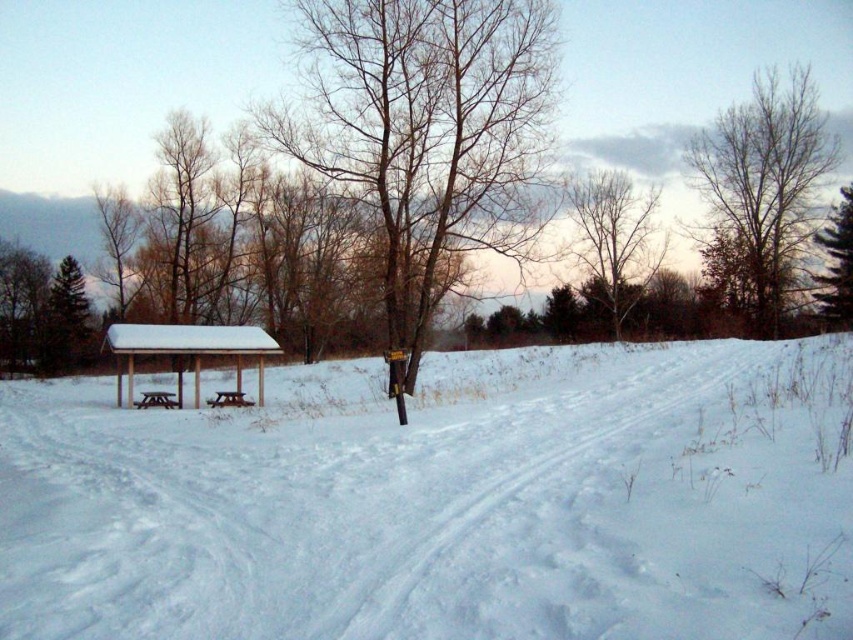
Is bare branches at center shorter than green matte tree at left?

No, bare branches at center is not shorter than green matte tree at left.

Does point (457, 179) come closer to viewer compared to point (62, 371)?

Yes, it is.

You are a GUI agent. You are given a task and a screenshot of the screen. Output one action in this format:
    pyautogui.click(x=<x>, y=<y>)
    Task: Click on the bare branches at center
    This screenshot has width=853, height=640.
    Given the screenshot: What is the action you would take?
    pyautogui.click(x=428, y=132)

Who is taller, white powdery snow at center or bare branches at upper center?

bare branches at upper center is taller.

Between white powdery snow at center and bare branches at upper center, which one has less height?

Standing shorter between the two is white powdery snow at center.

Who is more distant from viewer, [70,381] or [619,337]?

The point [619,337] is more distant.

Where is `white powdery snow at center`? Image resolution: width=853 pixels, height=640 pixels. white powdery snow at center is located at coordinates (444, 500).

The image size is (853, 640). What do you see at coordinates (444, 500) in the screenshot? I see `white powdery snow at center` at bounding box center [444, 500].

Find the location of a particular element. This screenshot has height=640, width=853. white powdery snow at center is located at coordinates (444, 500).

Does point (352, 438) come in front of point (354, 10)?

Yes, point (352, 438) is closer to viewer.

At what (x,y) coordinates should I click in order to perform the action: click on white powdery snow at center. Please return your answer as a coordinate pair (x, y). The height and width of the screenshot is (640, 853). Looking at the image, I should click on (444, 500).